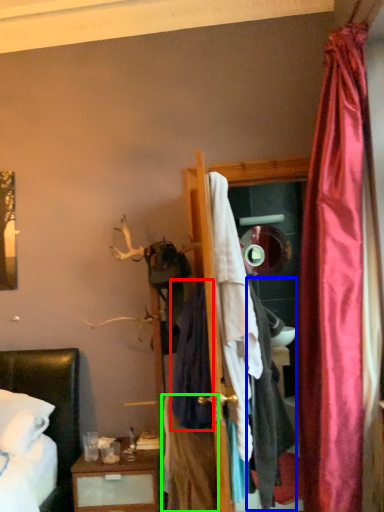
Question: Which object is the closest to the clothing (highlighted by a red box)? Choose among these: clothing (highlighted by a blue box) or clothing (highlighted by a green box).

Choices:
 (A) clothing
 (B) clothing

Answer: (B)